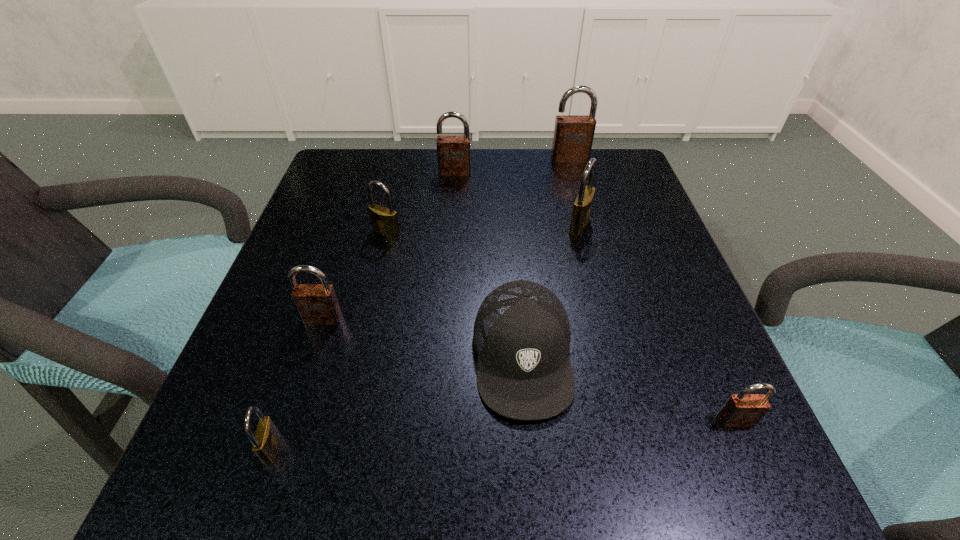
Where is `free location that satisfies the following two spatial constraints: 1. on the back side of the biggest brass padlock; 2. on the right side of the sixth object from right to left`? free location that satisfies the following two spatial constraints: 1. on the back side of the biggest brass padlock; 2. on the right side of the sixth object from right to left is located at coordinates (389, 225).